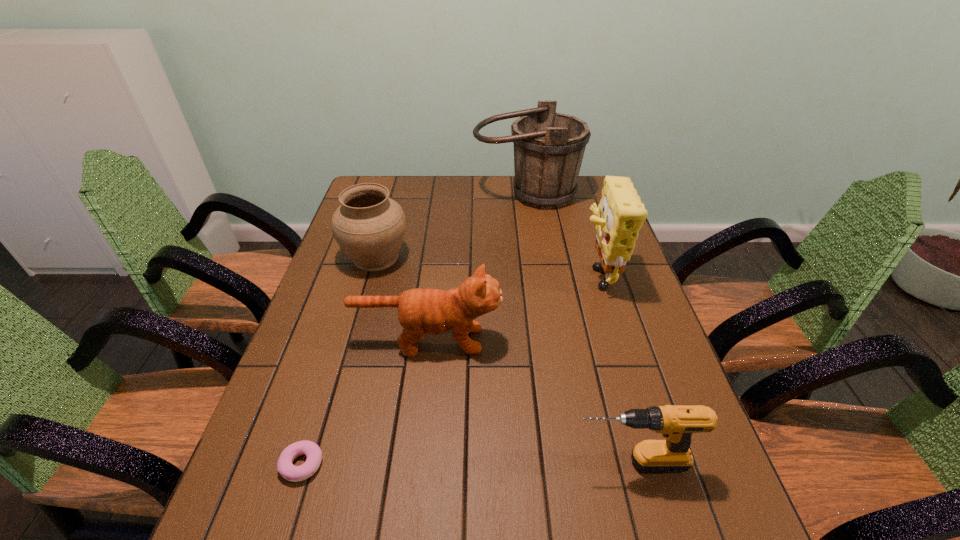
Identify the location of vacant area between the third nearest object and the drill. pyautogui.click(x=529, y=401).

Find the location of a particular element. empty location between the urn and the farthest object is located at coordinates (451, 226).

Identify the location of vacant area between the cat and the sponge. This screenshot has height=540, width=960. 512,306.

Where is `vacant space that is in between the pastry and the second shortest object`? This screenshot has width=960, height=540. vacant space that is in between the pastry and the second shortest object is located at coordinates (467, 463).

In order to click on free point between the drill and the sponge in this screenshot , I will do `click(613, 368)`.

The image size is (960, 540). Identify the location of blank region between the third nearest object and the farthest object. (477, 267).

Identify the location of vacant area between the urn and the farthest object. (451, 226).

This screenshot has height=540, width=960. In order to click on free spot between the urn and the farthest object in this screenshot , I will do `click(451, 226)`.

At what (x,y) coordinates should I click in order to perform the action: click on the third closest object to the pastry. Please return your answer as a coordinate pair (x, y). Looking at the image, I should click on (370, 227).

Point out which object is positioned as the second nearest to the pastry. Please provide its 2D coordinates. Your answer should be formatted as a tuple, i.e. [(x, y)], where the tuple contains the x and y coordinates of a point satisfying the conditions above.

[(676, 423)]